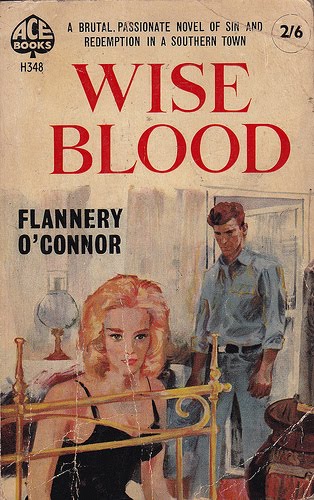
I want to click on bedfarme, so (x=87, y=402).